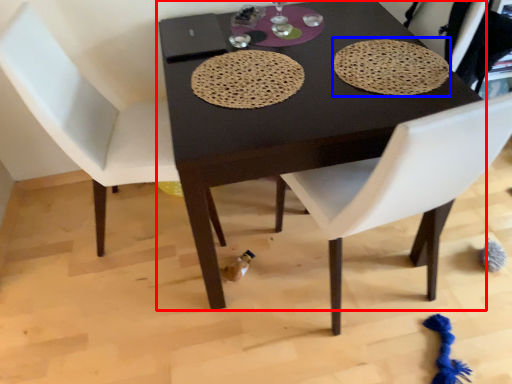
Question: Which of the following is the closest to the observer, table (highlighted by a red box) or mat (highlighted by a blue box)?

Choices:
 (A) table
 (B) mat

Answer: (A)